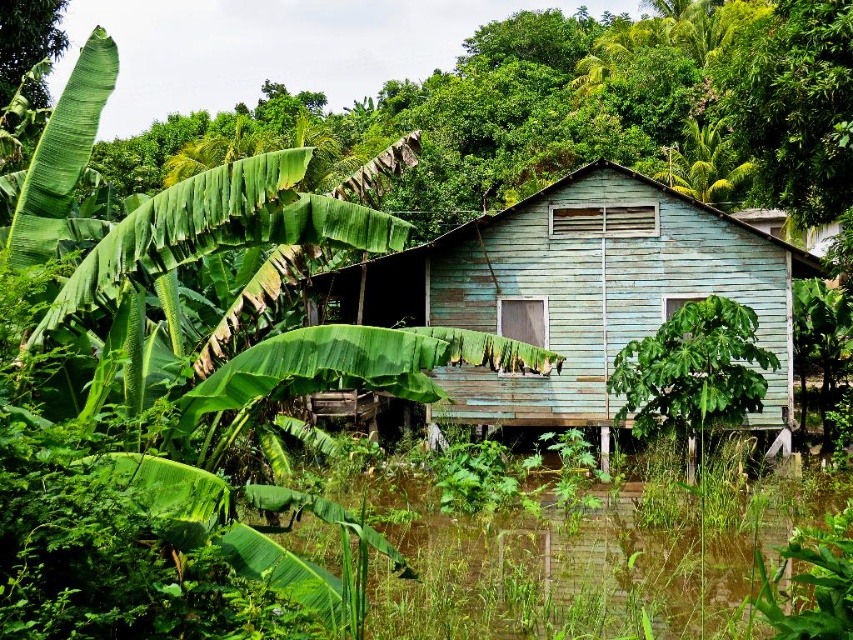
Question: Is green leafy banana tree at left further to camera compared to light blue wooden hut at center?

Choices:
 (A) no
 (B) yes

Answer: (A)

Question: Based on their relative distances, which object is farther from the light blue wooden hut at center?

Choices:
 (A) green leafy banana tree at left
 (B) green leafy plant at center

Answer: (A)

Question: Does light blue wooden hut at center appear over green leafy plant at center?

Choices:
 (A) yes
 (B) no

Answer: (B)

Question: Estimate the real-world distances between objects in this image. Which object is farther from the green leafy plant at center?

Choices:
 (A) light blue wooden hut at center
 (B) green leafy banana tree at left

Answer: (B)

Question: Which point is farther from the camera taking this photo?

Choices:
 (A) (273, 564)
 (B) (758, 385)
 (C) (393, 257)

Answer: (C)

Question: Is light blue wooden hut at center wider than green leafy plant at center?

Choices:
 (A) yes
 (B) no

Answer: (B)